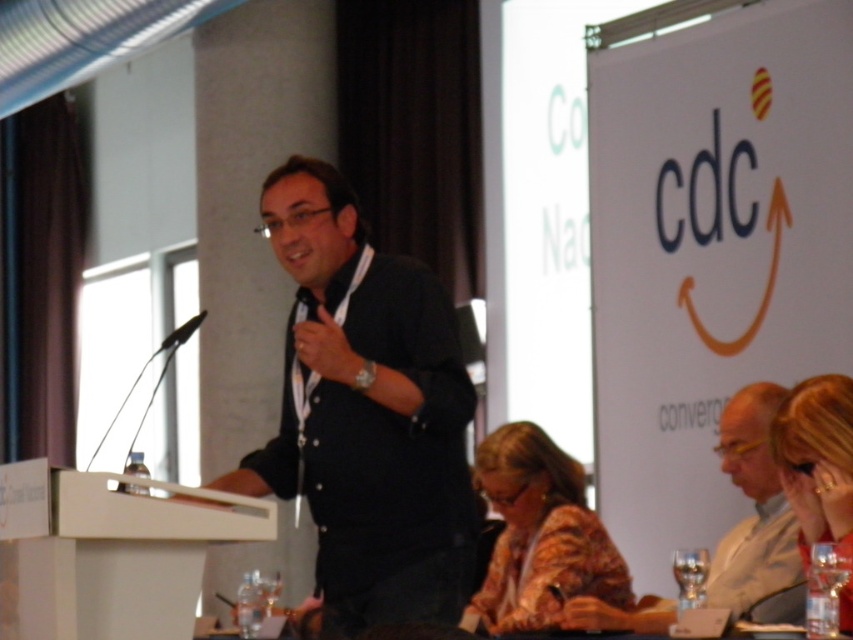
You are attending a conference and need to place a small note on the podium. Considering the height of the white matte podium at center and the light brown leather jacket at lower right, will the note be visible to the speaker from their current position?

The white matte podium at center has a lesser height compared to the light brown leather jacket at lower right. Since the podium is shorter, the note placed on it would likely be visible to the speaker as it sits lower than the jacket, which might be hanging on a higher surface or stand.